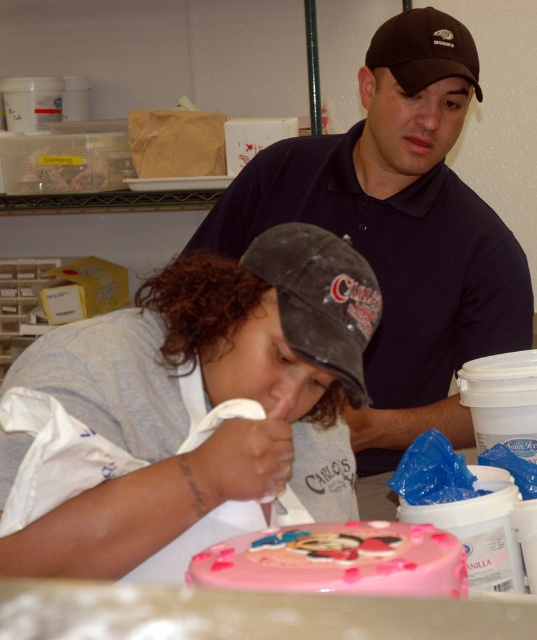
You are a photographer positioned in front of the scene. You want to take a photo that includes both the black matte baseball cap at upper center and the pink glossy cake at center. Which object should you focus on first to ensure both are in clear view?

You should focus on the black matte baseball cap at upper center first because it is closer to you than the pink glossy cake at center, ensuring both are in clear view.

You are a photographer trying to capture a clear shot of both the black matte baseball cap at upper center and the black fabric baseball cap at upper center in the scene. Since the photographer is standing at the same level as the caps, which one might appear larger in the photo?

The black matte baseball cap at upper center is much taller as the black fabric baseball cap at upper center, so it will appear larger in the photo.